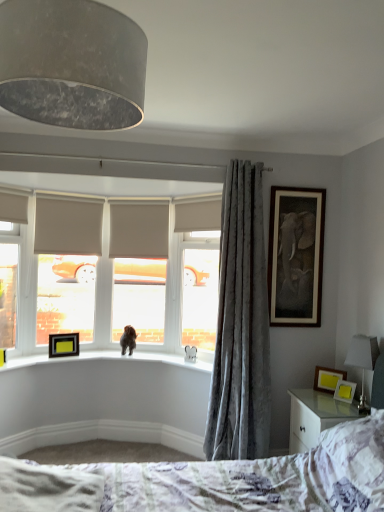
This screenshot has height=512, width=384. Describe the element at coordinates (63, 345) in the screenshot. I see `black matte picture frame at upper left, which ranks as the fourth picture frame in right-to-left order` at that location.

The height and width of the screenshot is (512, 384). I want to click on white plush elephant at window, marked as the 2th animal in a back-to-front arrangement, so click(190, 353).

What do you see at coordinates (296, 256) in the screenshot? I see `wooden-framed elephant artwork at upper right, arranged as the 1th picture frame when viewed from the top` at bounding box center [296, 256].

Measure the distance between white textured sheet at lower left and camera.

The depth of white textured sheet at lower left is 5.42 feet.

In order to face white textured sheet at lower left, should I rotate leftwards or rightwards?

A 19.678 degree turn to the left will do.

I want to click on matte yellow picture frame at lower right, which appears as the first picture frame when viewed from the right, so click(345, 391).

Identify the location of fluffy white bed at lower center. This screenshot has width=384, height=512. (214, 480).

Measure the distance between fluffy white bed at lower center and camera.

1.69 meters.

Image resolution: width=384 pixels, height=512 pixels. I want to click on black matte picture frame at upper left, marked as the 4th picture frame in a front-to-back arrangement, so click(63, 345).

Is matte beige roller blind at left, marked as the first window screen in a left-to-right arrangement, with white plush elephant at window, positioned as the 2th animal in left-to-right order?

matte beige roller blind at left, marked as the first window screen in a left-to-right arrangement, and white plush elephant at window, positioned as the 2th animal in left-to-right order, are clearly separated.

Does matte beige roller blind at left, marked as the first window screen in a left-to-right arrangement, turn towards white plush elephant at window, acting as the first animal starting from the front?

No, matte beige roller blind at left, marked as the first window screen in a left-to-right arrangement, does not turn towards white plush elephant at window, acting as the first animal starting from the front.

Considering the sizes of objects matte beige roller blind at left, positioned as the second window screen in right-to-left order, and white plush elephant at window, marked as the 2th animal in a back-to-front arrangement, in the image provided, who is shorter, matte beige roller blind at left, positioned as the second window screen in right-to-left order, or white plush elephant at window, marked as the 2th animal in a back-to-front arrangement,?

white plush elephant at window, marked as the 2th animal in a back-to-front arrangement.

Between white textured sheet at lower left and white plush elephant at window, marked as the 2th animal in a back-to-front arrangement, which one has less height?

white textured sheet at lower left is shorter.

Can you confirm if white textured sheet at lower left is thinner than white plush elephant at window, marked as the 2th animal in a back-to-front arrangement?

No.

What's the angular difference between white textured sheet at lower left and white plush elephant at window, acting as the first animal starting from the front,'s facing directions?

47.5 degrees separate the facing orientations of white textured sheet at lower left and white plush elephant at window, acting as the first animal starting from the front.

Based on the photo, in terms of size, does white textured sheet at lower left appear bigger or smaller than white plush elephant at window, positioned as the 2th animal in left-to-right order?

Clearly, white textured sheet at lower left is larger in size than white plush elephant at window, positioned as the 2th animal in left-to-right order.

Is white textured sheet at lower left positioned far away from fluffy white bed at lower center?

white textured sheet at lower left is actually quite close to fluffy white bed at lower center.

Which is more to the right, white textured sheet at lower left or fluffy white bed at lower center?

Positioned to the right is fluffy white bed at lower center.

Who is taller, white textured sheet at lower left or fluffy white bed at lower center?

fluffy white bed at lower center.

Is point (24, 467) less distant than point (196, 481)?

Yes, point (24, 467) is in front of point (196, 481).

Is matte beige roller blind at left, positioned as the second window screen in right-to-left order, oriented towards matte yellow picture frame at lower right, which appears as the first picture frame when viewed from the right?

No, matte beige roller blind at left, positioned as the second window screen in right-to-left order, is not oriented towards matte yellow picture frame at lower right, which appears as the first picture frame when viewed from the right.

Does matte beige roller blind at left, positioned as the second window screen in right-to-left order, have a lesser width compared to matte yellow picture frame at lower right, which is the fourth picture frame from back to front?

Indeed, matte beige roller blind at left, positioned as the second window screen in right-to-left order, has a lesser width compared to matte yellow picture frame at lower right, which is the fourth picture frame from back to front.

From the image's perspective, is matte beige roller blind at left, positioned as the second window screen in right-to-left order, beneath matte yellow picture frame at lower right, which appears as the first picture frame when viewed from the right?

Incorrect, from the image's perspective, matte beige roller blind at left, positioned as the second window screen in right-to-left order, is higher than matte yellow picture frame at lower right, which appears as the first picture frame when viewed from the right.

Is the surface of matte beige roller blind at left, positioned as the second window screen in right-to-left order, in direct contact with matte yellow picture frame at lower right, the first picture frame when ordered from front to back?

No, matte beige roller blind at left, positioned as the second window screen in right-to-left order, is not with matte yellow picture frame at lower right, the first picture frame when ordered from front to back.

Is white fabric lampshade at right located outside white textured sheet at lower left?

Yes, white fabric lampshade at right is outside of white textured sheet at lower left.

At what (x,y) coordinates should I click in order to perform the action: click on table lamp to the right of white textured sheet at lower left. Please return your answer as a coordinate pair (x, y). This screenshot has height=512, width=384. Looking at the image, I should click on (362, 360).

Would you say white fabric lampshade at right is a long distance from white textured sheet at lower left?

Yes, white fabric lampshade at right and white textured sheet at lower left are quite far apart.

Does white fabric lampshade at right turn towards white textured sheet at lower left?

Yes, white fabric lampshade at right is aimed at white textured sheet at lower left.

Which object is further away from the camera taking this photo, velvet gray curtain at right or white fabric lampshade at right?

velvet gray curtain at right is further from the camera.

Is point (218, 392) closer or farther from the camera than point (365, 356)?

Clearly, point (218, 392) is more distant from the camera than point (365, 356).

Is velvet gray curtain at right smaller than white fabric lampshade at right?

Incorrect, velvet gray curtain at right is not smaller in size than white fabric lampshade at right.

Locate an element on the screen. This screenshot has width=384, height=512. the 2nd picture frame below when counting from the white plush elephant at window, positioned as the 2th animal in left-to-right order (from the image's perspective) is located at coordinates (345, 391).

Is matte yellow picture frame at lower right, the fourth picture frame from the left, at the back of white plush elephant at window, acting as the first animal starting from the front?

white plush elephant at window, acting as the first animal starting from the front, does not have its back to matte yellow picture frame at lower right, the fourth picture frame from the left.

Considering the positions of objects white plush elephant at window, acting as the first animal starting from the front, and matte yellow picture frame at lower right, which appears as the first picture frame when ordered from the bottom, in the image provided, who is in front, white plush elephant at window, acting as the first animal starting from the front, or matte yellow picture frame at lower right, which appears as the first picture frame when ordered from the bottom,?

matte yellow picture frame at lower right, which appears as the first picture frame when ordered from the bottom, is more forward.

Considering the relative sizes of white plush elephant at window, acting as the first animal starting from the front, and matte yellow picture frame at lower right, which is the fourth picture frame from back to front, in the image provided, is white plush elephant at window, acting as the first animal starting from the front, bigger than matte yellow picture frame at lower right, which is the fourth picture frame from back to front,?

Indeed, white plush elephant at window, acting as the first animal starting from the front, has a larger size compared to matte yellow picture frame at lower right, which is the fourth picture frame from back to front.

At what (x,y) coordinates should I click in order to perform the action: click on the 2nd window screen to the left of the white plush elephant at window, acting as the first animal starting from the front, counting from the anchor's position. Please return your answer as a coordinate pair (x, y). Image resolution: width=384 pixels, height=512 pixels. Looking at the image, I should click on (66, 265).

Find the location of `sheet below the white plush elephant at window, acting as the first animal starting from the front (from the image's perspective)`. sheet below the white plush elephant at window, acting as the first animal starting from the front (from the image's perspective) is located at coordinates (48, 487).

Considering their positions, is white plush elephant at window, which is the 1th animal from right to left, positioned further to matte yellow picture frame at lower right, the fourth picture frame from the left, than matte gray roller blind at center, the 1th window screen viewed from the right?

matte gray roller blind at center, the 1th window screen viewed from the right, is positioned further to the anchor matte yellow picture frame at lower right, the fourth picture frame from the left.

Which object lies nearer to the anchor point wooden photo frame at right, arranged as the third picture frame when viewed from the back, matte yellow picture frame at lower right, which ranks as the 4th picture frame in top-to-bottom order, or matte gray lampshade at upper left?

matte yellow picture frame at lower right, which ranks as the 4th picture frame in top-to-bottom order, is closer to wooden photo frame at right, arranged as the third picture frame when viewed from the back.

From the image, which object appears to be farther from wooden photo frame at right, marked as the 3th picture frame in a left-to-right arrangement, brown furry dog at window, the first animal positioned from the back, or wooden-framed elephant artwork at upper right, the 4th picture frame from the bottom?

brown furry dog at window, the first animal positioned from the back, is further to wooden photo frame at right, marked as the 3th picture frame in a left-to-right arrangement.

From the image, which object appears to be farther from white textured sheet at lower left, white plush elephant at window, which is the 1th animal from right to left, or matte yellow picture frame at lower right, the fourth picture frame from the left?

The object further to white textured sheet at lower left is matte yellow picture frame at lower right, the fourth picture frame from the left.

Based on their spatial positions, is black matte picture frame at upper left, marked as the 4th picture frame in a front-to-back arrangement, or wooden-framed elephant artwork at upper right, arranged as the 1th picture frame when viewed from the top, further from white textured sheet at lower left?

wooden-framed elephant artwork at upper right, arranged as the 1th picture frame when viewed from the top, lies further to white textured sheet at lower left than the other object.

Estimate the real-world distances between objects in this image. Which object is closer to white textured sheet at lower left, velvet gray curtain at right or wooden photo frame at right, arranged as the third picture frame when viewed from the back?

Based on the image, velvet gray curtain at right appears to be nearer to white textured sheet at lower left.

Looking at the image, which one is located further to wooden photo frame at right, marked as the 3th picture frame in a left-to-right arrangement, wooden-framed elephant artwork at upper right, placed as the second picture frame when sorted from left to right, or velvet gray curtain at right?

The object further to wooden photo frame at right, marked as the 3th picture frame in a left-to-right arrangement, is wooden-framed elephant artwork at upper right, placed as the second picture frame when sorted from left to right.

Looking at this image, estimate the real-world distances between objects in this image. Which object is further from matte gray roller blind at center, which appears as the second window screen when viewed from the left, matte gray lampshade at upper left or wooden-framed elephant artwork at upper right, arranged as the 1th picture frame when viewed from the top?

matte gray lampshade at upper left is positioned further to the anchor matte gray roller blind at center, which appears as the second window screen when viewed from the left.

Locate an element on the screen. The height and width of the screenshot is (512, 384). table lamp between matte gray lampshade at upper left and white plush elephant at window, acting as the first animal starting from the front, in the front-back direction is located at coordinates (362, 360).

The image size is (384, 512). What are the coordinates of `table lamp between fluffy white bed at lower center and matte yellow picture frame at lower right, the first picture frame when ordered from front to back, from front to back` in the screenshot? It's located at (362, 360).

Where is `window screen between black matte picture frame at upper left, which is counted as the second picture frame, starting from the top, and velvet gray curtain at right from left to right`? The width and height of the screenshot is (384, 512). window screen between black matte picture frame at upper left, which is counted as the second picture frame, starting from the top, and velvet gray curtain at right from left to right is located at coordinates (139, 268).

The image size is (384, 512). Find the location of `window screen between matte beige roller blind at left, positioned as the second window screen in right-to-left order, and matte yellow picture frame at lower right, which appears as the first picture frame when viewed from the right`. window screen between matte beige roller blind at left, positioned as the second window screen in right-to-left order, and matte yellow picture frame at lower right, which appears as the first picture frame when viewed from the right is located at coordinates (139, 268).